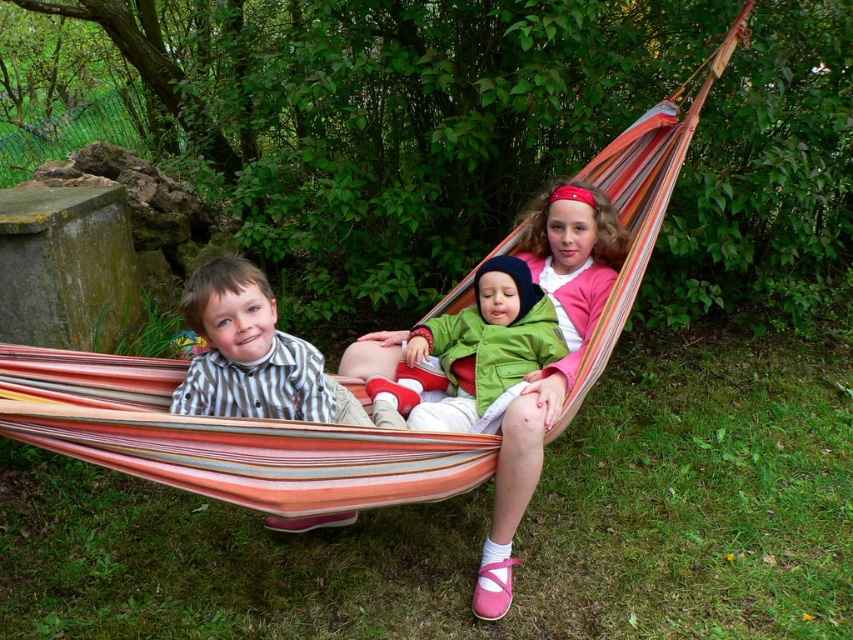
You are a photographer trying to capture a photo of the striped fabric hammock at center and the striped cotton shirt at center. Since you want to focus on the taller object, which one should you zoom in on?

The striped fabric hammock at center is much taller than the striped cotton shirt at center, so you should zoom in on the striped fabric hammock at center.

You are a photographer trying to capture the perfect shot of the scene. You need to focus on the pink fabric at center. According to the coordinates provided, where should you aim your camera to ensure it is centered in the frame?

The pink fabric at center is located at coordinates point (549, 364), so you should aim your camera at that point to center it in the frame.

You are a photographer trying to capture a closeup of the pink fabric at center and the green matte jacket at center. Given that your camera can only focus on one object at a time, which object should you prioritize to ensure it fills more of the frame without moving the camera?

The pink fabric at center should be prioritized because it is larger in size than the green matte jacket at center, allowing it to fill more of the camera frame without needing to adjust the camera position.